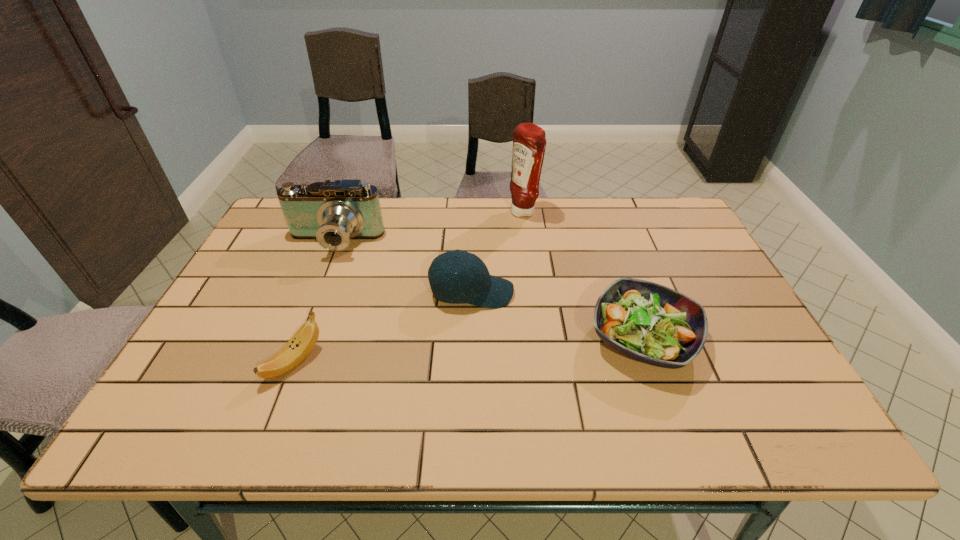
The image size is (960, 540). Find the location of `the farthest object`. the farthest object is located at coordinates (529, 142).

The height and width of the screenshot is (540, 960). I want to click on the fourth object from left to right, so click(529, 142).

This screenshot has width=960, height=540. I want to click on the fourth shortest object, so click(333, 213).

You are a GUI agent. You are given a task and a screenshot of the screen. Output one action in this format:
    pyautogui.click(x=<x>, y=<y>)
    Task: Click on the camcorder
    
    Given the screenshot: What is the action you would take?
    pyautogui.click(x=333, y=213)

Image resolution: width=960 pixels, height=540 pixels. I want to click on the third shortest object, so click(473, 284).

At what (x,y) coordinates should I click in order to perform the action: click on the third object from left to right. Please return your answer as a coordinate pair (x, y). The width and height of the screenshot is (960, 540). Looking at the image, I should click on (473, 284).

Find the location of a particular element. banana is located at coordinates (303, 341).

Where is `salad plate`? This screenshot has width=960, height=540. salad plate is located at coordinates (x=648, y=322).

I want to click on vacant space situated on the front of the condiment, so click(x=537, y=314).

This screenshot has height=540, width=960. Identify the location of blank space located 0.320m on the front-facing side of the camcorder. (292, 349).